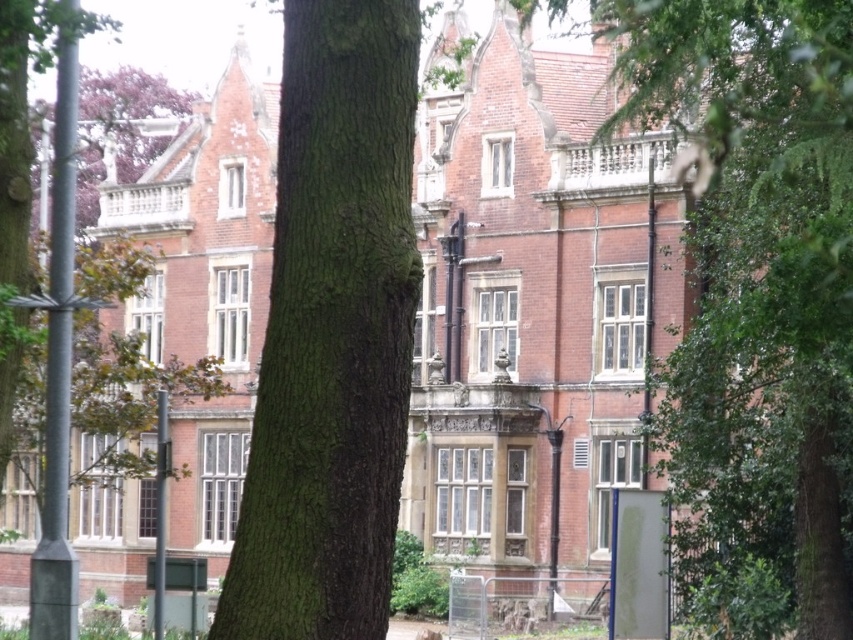
Question: Which point appears closest to the camera in this image?

Choices:
 (A) (294, 628)
 (B) (850, 269)

Answer: (A)

Question: Does green leafy tree at center appear over green rough bark tree at center?

Choices:
 (A) no
 (B) yes

Answer: (A)

Question: Does green leafy tree at center have a greater width compared to green rough bark tree at center?

Choices:
 (A) yes
 (B) no

Answer: (B)

Question: Does green leafy tree at center appear over green rough bark tree at center?

Choices:
 (A) yes
 (B) no

Answer: (B)